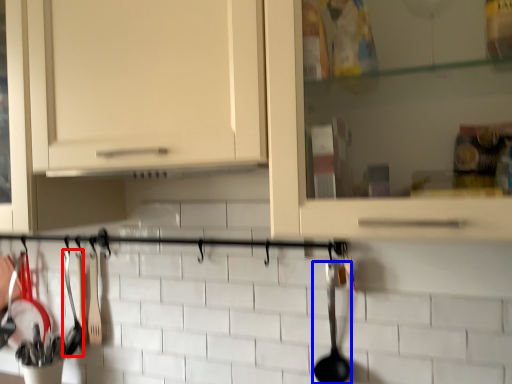
Question: Which of the following is the farthest to the observer, silverware (highlighted by a red box) or silverware (highlighted by a blue box)?

Choices:
 (A) silverware
 (B) silverware

Answer: (A)